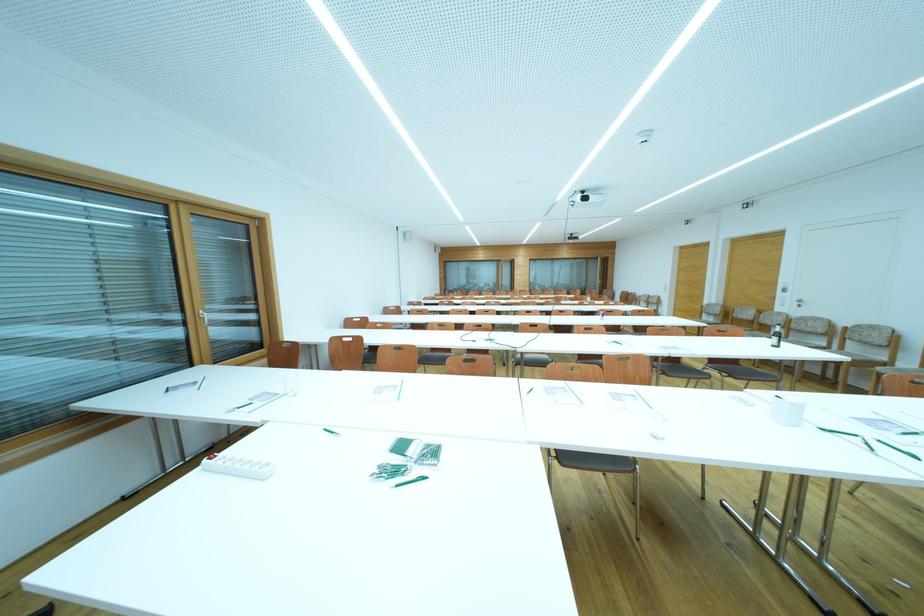
Where is `white light switch`? white light switch is located at coordinates (407, 236).